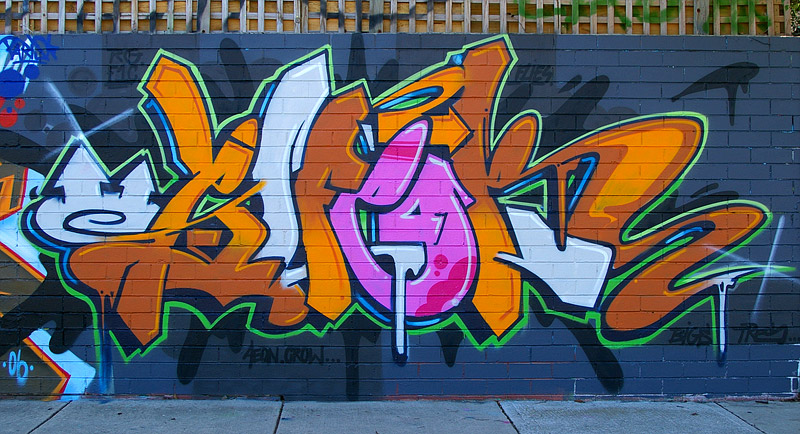
At what (x,y) coordinates should I click in order to perform the action: click on dark pink in wall tag. Please return your answer as a coordinate pair (x, y). Looking at the image, I should click on coord(396,147), coord(450,292).